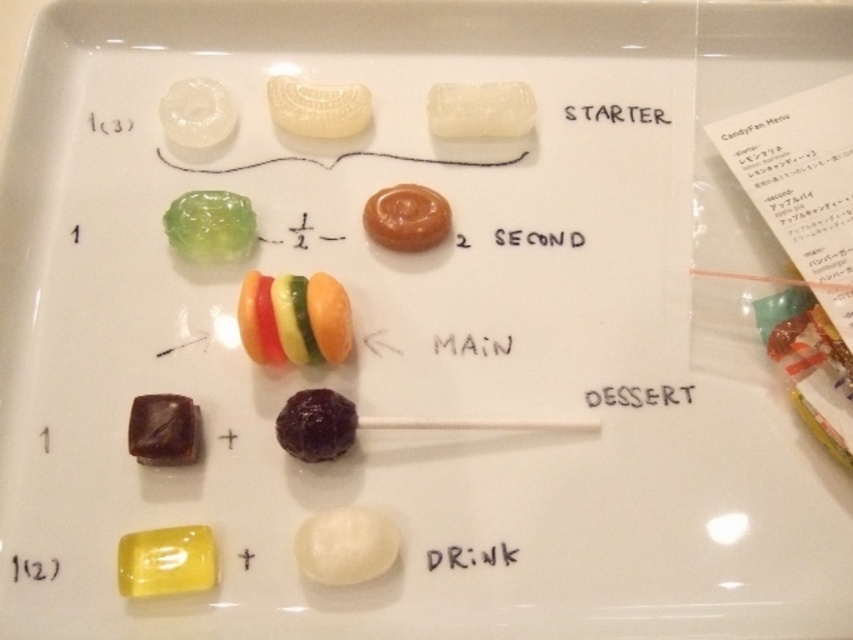
Question: Which object appears closest to the camera in this image?

Choices:
 (A) white glossy candy at lower center
 (B) black matte drink at bottom center
 (C) matte caramel candy at center

Answer: (A)

Question: Does translucent white candy at center come in front of black matte drink at bottom center?

Choices:
 (A) no
 (B) yes

Answer: (A)

Question: Is white glossy candy at lower center thinner than translucent white candy at center?

Choices:
 (A) no
 (B) yes

Answer: (B)

Question: From the image, what is the correct spatial relationship of white glossy candy at lower center in relation to translucent green jelly at upper left?

Choices:
 (A) left
 (B) right

Answer: (B)

Question: Which object is farther from the camera taking this photo?

Choices:
 (A) black paper at upper center
 (B) matte caramel candy at center

Answer: (A)

Question: Among these objects, which one is nearest to the camera?

Choices:
 (A) translucent white candy at center
 (B) white glossy candy at upper center

Answer: (B)